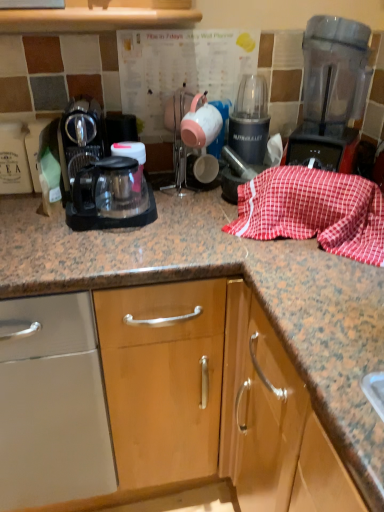
Question: Considering the relative sizes of matte ceramic tea pot at center and red checkered cloth at center in the image provided, is matte ceramic tea pot at center bigger than red checkered cloth at center?

Choices:
 (A) yes
 (B) no

Answer: (B)

Question: Is matte ceramic tea pot at center at the left side of red checkered cloth at center?

Choices:
 (A) yes
 (B) no

Answer: (A)

Question: Does matte ceramic tea pot at center turn towards red checkered cloth at center?

Choices:
 (A) no
 (B) yes

Answer: (A)

Question: Does matte ceramic tea pot at center come behind red checkered cloth at center?

Choices:
 (A) yes
 (B) no

Answer: (A)

Question: From the image's perspective, would you say matte ceramic tea pot at center is positioned over red checkered cloth at center?

Choices:
 (A) yes
 (B) no

Answer: (A)

Question: Does matte ceramic tea pot at center come in front of red checkered cloth at center?

Choices:
 (A) yes
 (B) no

Answer: (B)

Question: Is black plastic blender at center outside of matte ceramic tea pot at center?

Choices:
 (A) yes
 (B) no

Answer: (A)

Question: From a real-world perspective, is black plastic blender at center positioned under matte ceramic tea pot at center based on gravity?

Choices:
 (A) yes
 (B) no

Answer: (A)

Question: Considering the relative sizes of black plastic blender at center and matte ceramic tea pot at center in the image provided, is black plastic blender at center smaller than matte ceramic tea pot at center?

Choices:
 (A) no
 (B) yes

Answer: (A)

Question: Considering the relative sizes of black plastic blender at center and matte ceramic tea pot at center in the image provided, is black plastic blender at center taller than matte ceramic tea pot at center?

Choices:
 (A) yes
 (B) no

Answer: (A)

Question: From a real-world perspective, does black plastic blender at center stand above matte ceramic tea pot at center?

Choices:
 (A) no
 (B) yes

Answer: (A)

Question: From the image's perspective, is black plastic blender at center located beneath matte ceramic tea pot at center?

Choices:
 (A) no
 (B) yes

Answer: (A)

Question: Could black plastic coffee maker at left be considered to be inside matte ceramic tea pot at center?

Choices:
 (A) no
 (B) yes

Answer: (A)